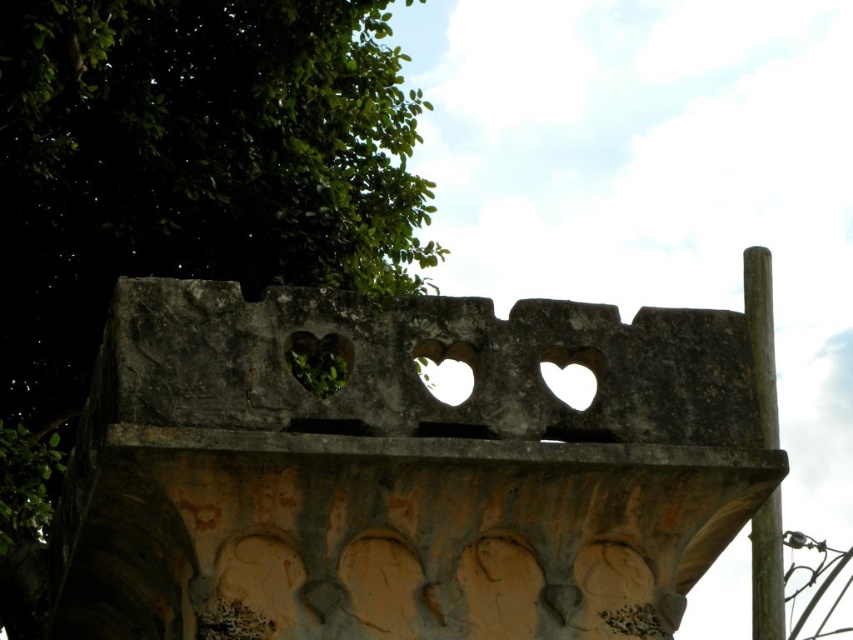
Between gray stone heart holes at center and green leafy tree at upper left, which one has more height?

Standing taller between the two is green leafy tree at upper left.

Is gray stone heart holes at center further to camera compared to green leafy tree at upper left?

No, gray stone heart holes at center is in front of green leafy tree at upper left.

Who is more distant from viewer, (567, 572) or (177, 253)?

Positioned behind is point (177, 253).

Locate an element on the screen. Image resolution: width=853 pixels, height=640 pixels. gray stone heart holes at center is located at coordinates (402, 470).

The image size is (853, 640). What do you see at coordinates (402, 470) in the screenshot?
I see `gray stone heart holes at center` at bounding box center [402, 470].

Find the location of a particular element. This screenshot has width=853, height=640. gray stone heart holes at center is located at coordinates (402, 470).

Identify the location of gray stone heart holes at center. (402, 470).

Based on the photo, how far apart are green leafy tree at upper left and brown wood pole at right?

A distance of 25.91 meters exists between green leafy tree at upper left and brown wood pole at right.

Does green leafy tree at upper left appear over brown wood pole at right?

Yes.

Between point (49, 372) and point (758, 545), which one is positioned behind?

The point (758, 545) is behind.

Find the location of a particular element. green leafy tree at upper left is located at coordinates (190, 166).